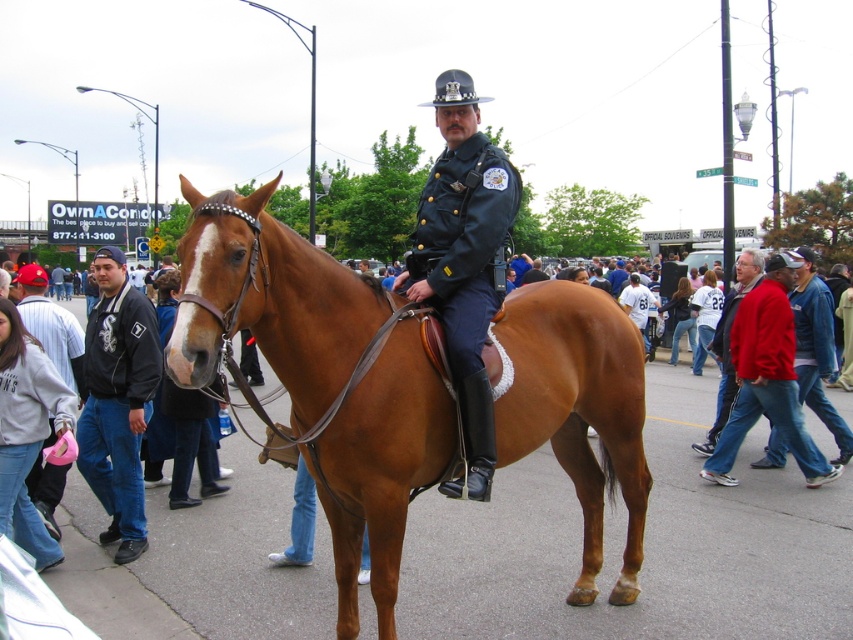
You are standing in the crowd watching the mounted police officer. You notice two points in the scene. One is at coordinate point (474,397) and the other is at point (67,355). Which point is closer to you?

Point (474,397) is closer to the viewer than point (67,355).

You are a photographer at the event and need to capture a photo of the mounted police officer. You notice the red cotton jacket at lower right and the brushed metal water at bottle left in the background. To ensure both objects are visible in the frame, which object should you position closer to the edge of the photo?

Since the red cotton jacket at lower right is narrower than the brushed metal water at bottle left, you should position the red cotton jacket at lower right closer to the edge of the photo to ensure both objects fit within the frame.

What is the 2D coordinate of the shiny dark blue uniform at center?

The shiny dark blue uniform at center is located at the 2D coordinate point of [463,260].